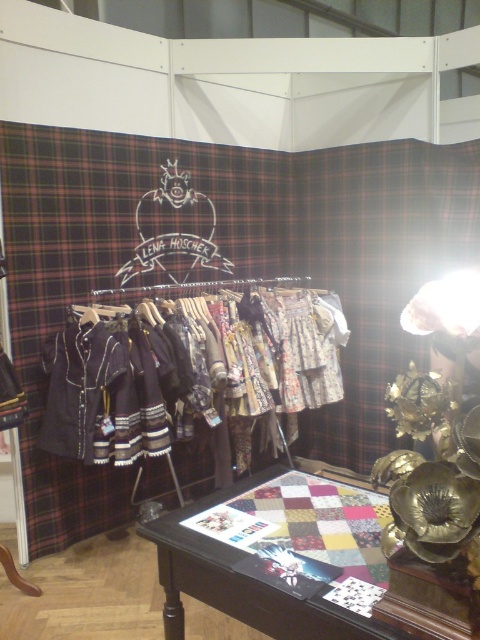
Who is more forward, (337, 358) or (167, 616)?

Point (167, 616)

Who is higher up, textured woolen jackets at center or wooden quilted table at center?

textured woolen jackets at center is above.

Is point (194, 339) less distant than point (163, 538)?

No, it is not.

You are a GUI agent. You are given a task and a screenshot of the screen. Output one action in this format:
    pyautogui.click(x=<x>, y=<y>)
    Task: Click on the textured woolen jackets at center
    
    Given the screenshot: What is the action you would take?
    pyautogui.click(x=187, y=371)